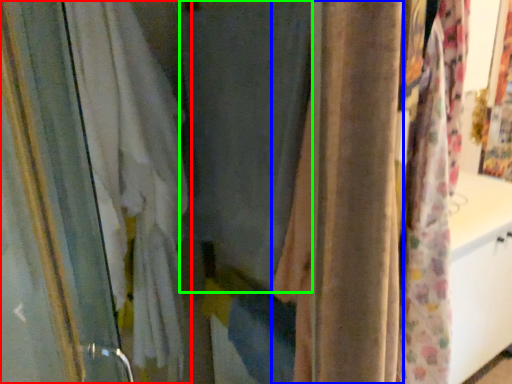
Question: Which is farther away from curtain (highlighted by a red box)? curtain (highlighted by a blue box) or curtain (highlighted by a green box)?

Choices:
 (A) curtain
 (B) curtain

Answer: (A)